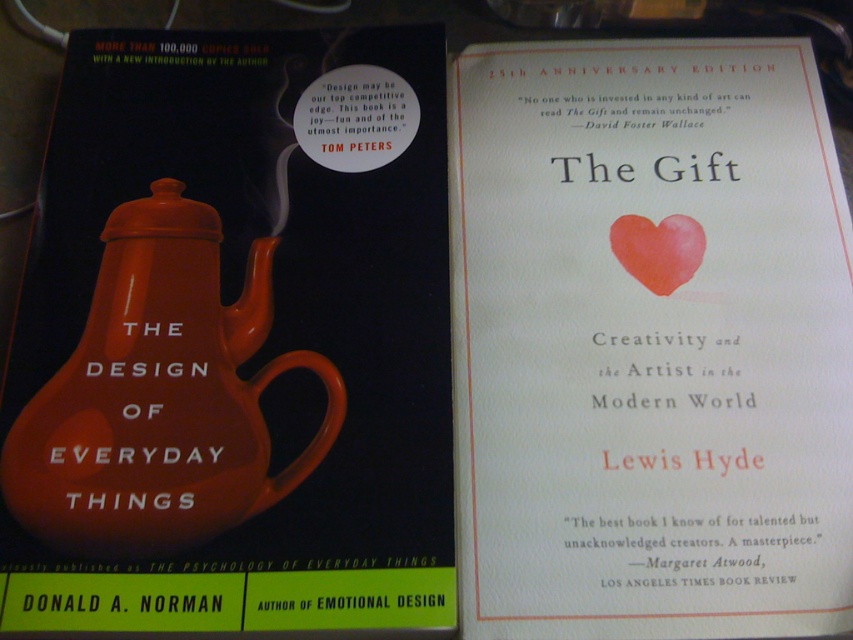
You are organizing a bookshelf and need to place the matte paper cover at center and the matte ceramic teapot at left. Since the shelf has limited vertical space, which object should you place first to ensure both fit vertically?

The matte ceramic teapot at left should be placed first because the matte paper cover at center is much taller, so placing the shorter teapot first allows room for the taller cover above or below.

From the picture: What is the position of the matte ceramic teapot at center relative to the matte paper cover at center?

The matte ceramic teapot at center is to the left of the matte paper cover at center.